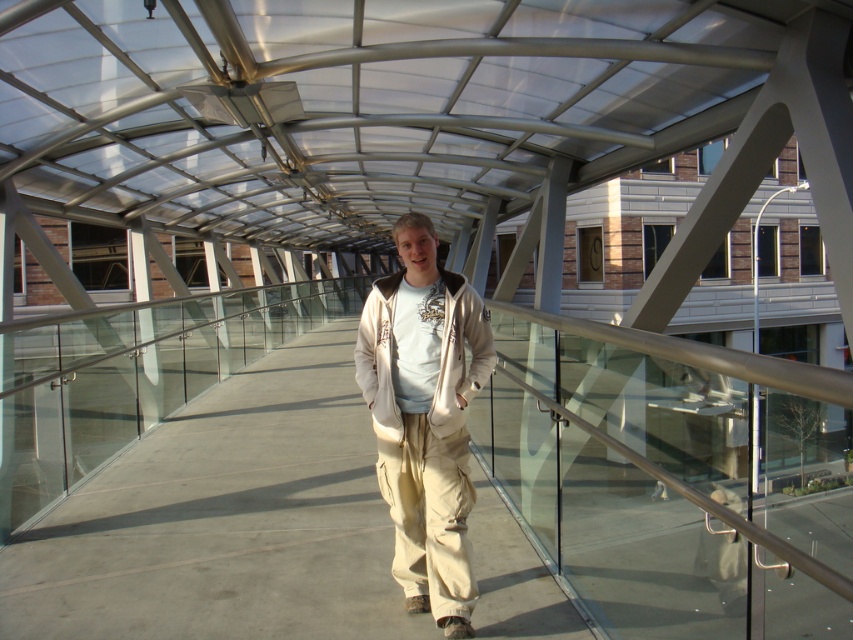
You are a photographer standing on the bridge and want to take a photo of the beige fabric pants at center and the beige fleece sweatshirt at center. If your camera has a maximum focus range of 1 meter, will both items be in focus?

The beige fabric pants at center is 1.25 meters away from beige fleece sweatshirt at center. Since the maximum focus range is 1 meter, the camera cannot focus on both items simultaneously because the distance between them exceeds the focus range.